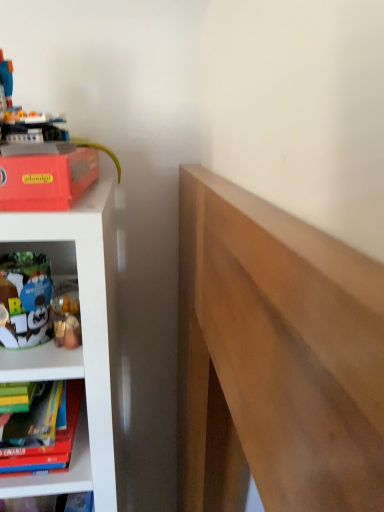
Find the location of a particular element. white plush toy at lower left, the 2th toy from the top is located at coordinates (24, 298).

Considering the relative positions of white plush toy at lower left, which is counted as the 1th toy, starting from the bottom, and plastic toy robot at upper left, the 2th toy in the bottom-to-top sequence, in the image provided, is white plush toy at lower left, which is counted as the 1th toy, starting from the bottom, to the right of plastic toy robot at upper left, the 2th toy in the bottom-to-top sequence, from the viewer's perspective?

Indeed, white plush toy at lower left, which is counted as the 1th toy, starting from the bottom, is positioned on the right side of plastic toy robot at upper left, the 2th toy in the bottom-to-top sequence.

Is white plush toy at lower left, the 2th toy from the top, looking in the opposite direction of plastic toy robot at upper left, the 2th toy in the bottom-to-top sequence?

That's not correct — white plush toy at lower left, the 2th toy from the top, is not looking away from plastic toy robot at upper left, the 2th toy in the bottom-to-top sequence.

Considering the sizes of objects white plush toy at lower left, the 2th toy from the top, and plastic toy robot at upper left, arranged as the first toy when viewed from the top, in the image provided, who is shorter, white plush toy at lower left, the 2th toy from the top, or plastic toy robot at upper left, arranged as the first toy when viewed from the top,?

Standing shorter between the two is white plush toy at lower left, the 2th toy from the top.

Is white plush toy at lower left, the 2th toy from the top, inside or outside of plastic toy robot at upper left, arranged as the first toy when viewed from the top?

Answer: white plush toy at lower left, the 2th toy from the top, is located beyond the bounds of plastic toy robot at upper left, arranged as the first toy when viewed from the top.

Looking at this image, can you tell me how much matte red paperback book at upper left and plastic toy robot at upper left, the 2th toy in the bottom-to-top sequence, differ in facing direction?

They differ by 1.04 degrees in their facing directions.

Based on the photo, does matte red paperback book at upper left have a greater width compared to plastic toy robot at upper left, arranged as the first toy when viewed from the top?

No.

Is point (86, 164) behind point (12, 116)?

No, (86, 164) is in front of (12, 116).

Is matte red paperback book at upper left behind plastic toy robot at upper left, the 2th toy in the bottom-to-top sequence?

No, matte red paperback book at upper left is closer to the camera.

From the image's perspective, is plastic toy robot at upper left, arranged as the first toy when viewed from the top, under matte red paperback book at upper left?

No.

Which is in front, plastic toy robot at upper left, the 2th toy in the bottom-to-top sequence, or matte red paperback book at upper left?

matte red paperback book at upper left is in front.

Does plastic toy robot at upper left, the 2th toy in the bottom-to-top sequence, touch matte red paperback book at upper left?

Absolutely, plastic toy robot at upper left, the 2th toy in the bottom-to-top sequence, is next to and touching matte red paperback book at upper left.

Locate an element on the screen. paperback book that appears above the white plush toy at lower left, which is counted as the 1th toy, starting from the bottom (from the image's perspective) is located at coordinates (46, 178).

In terms of width, does white plush toy at lower left, which is counted as the 1th toy, starting from the bottom, look wider or thinner when compared to matte red paperback book at upper left?

white plush toy at lower left, which is counted as the 1th toy, starting from the bottom, is thinner than matte red paperback book at upper left.

Is matte red paperback book at upper left completely or partially inside white plush toy at lower left, the 2th toy from the top?

No, matte red paperback book at upper left is located outside of white plush toy at lower left, the 2th toy from the top.

From a real-world perspective, is plastic toy robot at upper left, arranged as the first toy when viewed from the top, positioned above or below white plush toy at lower left, which is counted as the 1th toy, starting from the bottom?

plastic toy robot at upper left, arranged as the first toy when viewed from the top, is situated higher than white plush toy at lower left, which is counted as the 1th toy, starting from the bottom, in the real world.

The height and width of the screenshot is (512, 384). Identify the location of toy located on the left of white plush toy at lower left, the 2th toy from the top. (25, 114).

How many degrees apart are the facing directions of plastic toy robot at upper left, the 2th toy in the bottom-to-top sequence, and white plush toy at lower left, the 2th toy from the top?

The angle between the facing direction of plastic toy robot at upper left, the 2th toy in the bottom-to-top sequence, and the facing direction of white plush toy at lower left, the 2th toy from the top, is 0.584 degrees.

Which of these two, plastic toy robot at upper left, the 2th toy in the bottom-to-top sequence, or white plush toy at lower left, the 2th toy from the top, is bigger?

plastic toy robot at upper left, the 2th toy in the bottom-to-top sequence, is bigger.

At what (x,y) coordinates should I click in order to perform the action: click on toy that appears on the right of matte red paperback book at upper left. Please return your answer as a coordinate pair (x, y). The width and height of the screenshot is (384, 512). Looking at the image, I should click on (24, 298).

From the picture: Does matte red paperback book at upper left appear on the right side of white plush toy at lower left, the 2th toy from the top?

In fact, matte red paperback book at upper left is to the left of white plush toy at lower left, the 2th toy from the top.

Which of these two, matte red paperback book at upper left or white plush toy at lower left, the 2th toy from the top, stands shorter?

matte red paperback book at upper left.

From a real-world perspective, is matte red paperback book at upper left beneath white plush toy at lower left, the 2th toy from the top?

Incorrect, from a real-world perspective, matte red paperback book at upper left is higher than white plush toy at lower left, the 2th toy from the top.

Identify the location of toy lying below the plastic toy robot at upper left, arranged as the first toy when viewed from the top (from the image's perspective). (24, 298).

What are the coordinates of `paperback book on the right of plastic toy robot at upper left, arranged as the first toy when viewed from the top` in the screenshot? It's located at (46, 178).

Which object lies further to the anchor point white plush toy at lower left, which is counted as the 1th toy, starting from the bottom, matte red paperback book at upper left or plastic toy robot at upper left, the 2th toy in the bottom-to-top sequence?

plastic toy robot at upper left, the 2th toy in the bottom-to-top sequence.

Which object lies nearer to the anchor point plastic toy robot at upper left, the 2th toy in the bottom-to-top sequence, white plush toy at lower left, the 2th toy from the top, or matte red paperback book at upper left?

The object closer to plastic toy robot at upper left, the 2th toy in the bottom-to-top sequence, is matte red paperback book at upper left.

Considering their positions, is white plush toy at lower left, the 2th toy from the top, positioned closer to matte red paperback book at upper left than plastic toy robot at upper left, the 2th toy in the bottom-to-top sequence?

The object closer to matte red paperback book at upper left is plastic toy robot at upper left, the 2th toy in the bottom-to-top sequence.

Which object lies further to the anchor point plastic toy robot at upper left, the 2th toy in the bottom-to-top sequence, matte red paperback book at upper left or white plush toy at lower left, which is counted as the 1th toy, starting from the bottom?

white plush toy at lower left, which is counted as the 1th toy, starting from the bottom, lies further to plastic toy robot at upper left, the 2th toy in the bottom-to-top sequence, than the other object.

From the picture: Which object lies nearer to the anchor point white plush toy at lower left, which is counted as the 1th toy, starting from the bottom, plastic toy robot at upper left, the 2th toy in the bottom-to-top sequence, or matte red paperback book at upper left?

matte red paperback book at upper left is closer to white plush toy at lower left, which is counted as the 1th toy, starting from the bottom.

Estimate the real-world distances between objects in this image. Which object is closer to matte red paperback book at upper left, plastic toy robot at upper left, the 2th toy in the bottom-to-top sequence, or white plush toy at lower left, which is counted as the 1th toy, starting from the bottom?

plastic toy robot at upper left, the 2th toy in the bottom-to-top sequence, lies closer to matte red paperback book at upper left than the other object.

Locate an element on the screen. paperback book between plastic toy robot at upper left, the 2th toy in the bottom-to-top sequence, and white plush toy at lower left, which is counted as the 1th toy, starting from the bottom, vertically is located at coordinates (46, 178).